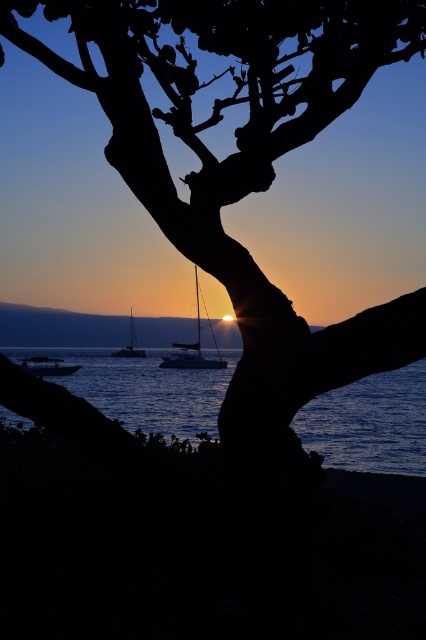
You are standing on the beach and see the silhouette bark tree at center and the blue water at center. Which object is located to the right of the other?

The blue water at center is located to the right of the silhouette bark tree at center because the silhouette bark tree at center is positioned on the left side of blue water at center.

You are an artist trying to paint the sunset scene. You have two main subjects to focus on, the silhouette bark tree at center and the shiny silver sailboat at center. Which one should you spend more time detailing because it takes up more space in the image?

The shiny silver sailboat at center takes up more space in the image than the silhouette bark tree at center, so you should spend more time detailing the shiny silver sailboat at center.